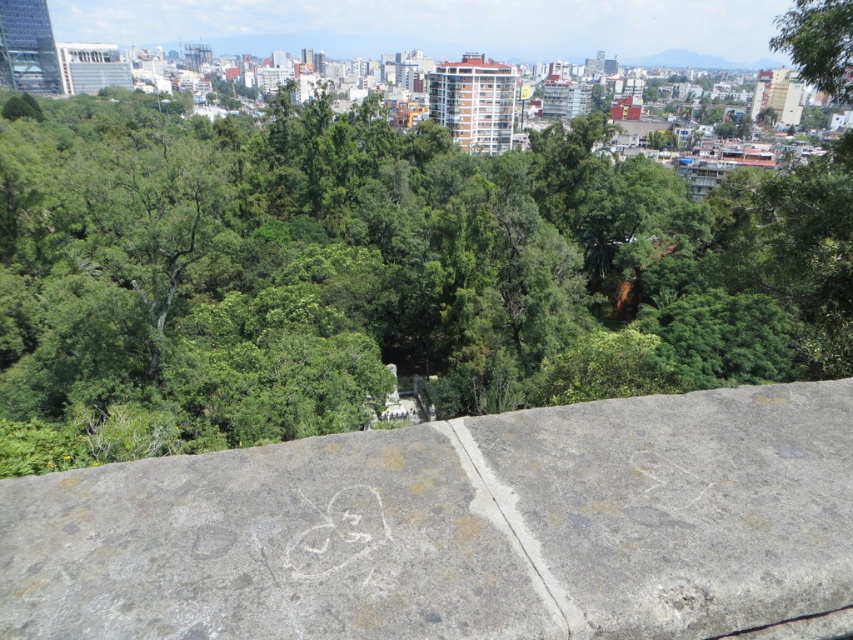
Question: Is the position of green leafy tree at center more distant than that of gray concrete wall at center?

Choices:
 (A) no
 (B) yes

Answer: (B)

Question: Among these points, which one is farthest from the camera?

Choices:
 (A) (218, 637)
 (B) (62, 131)

Answer: (B)

Question: Which point appears farthest from the camera in this image?

Choices:
 (A) (827, 572)
 (B) (126, 150)

Answer: (B)

Question: Is green leafy tree at center positioned in front of gray concrete wall at center?

Choices:
 (A) no
 (B) yes

Answer: (A)

Question: Is green leafy tree at center smaller than gray concrete wall at center?

Choices:
 (A) yes
 (B) no

Answer: (B)

Question: Which point is closer to the camera taking this photo?

Choices:
 (A) (294, 461)
 (B) (103, 356)

Answer: (A)